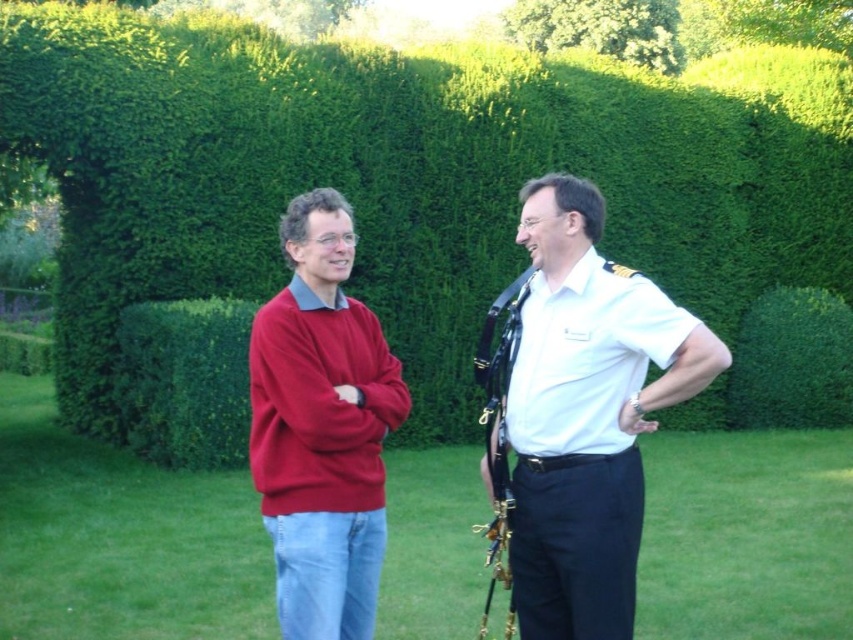
Question: Among these objects, which one is nearest to the camera?

Choices:
 (A) matte red sweater at center
 (B) green leafy hedge at upper center

Answer: (A)

Question: Is matte red sweater at center bigger than green leafy bush at upper center?

Choices:
 (A) yes
 (B) no

Answer: (B)

Question: Can you confirm if matte red sweater at center is bigger than green leafy bush at upper center?

Choices:
 (A) no
 (B) yes

Answer: (A)

Question: Which point is farther from the camera taking this photo?

Choices:
 (A) (x=311, y=122)
 (B) (x=308, y=308)
 (C) (x=247, y=621)
 (D) (x=807, y=292)

Answer: (D)

Question: Which point is farther to the camera?

Choices:
 (A) 828,634
 (B) 672,340
 (C) 296,397

Answer: (A)

Question: In this image, where is green grass at center located relative to matte red sweater at center?

Choices:
 (A) below
 (B) above

Answer: (A)